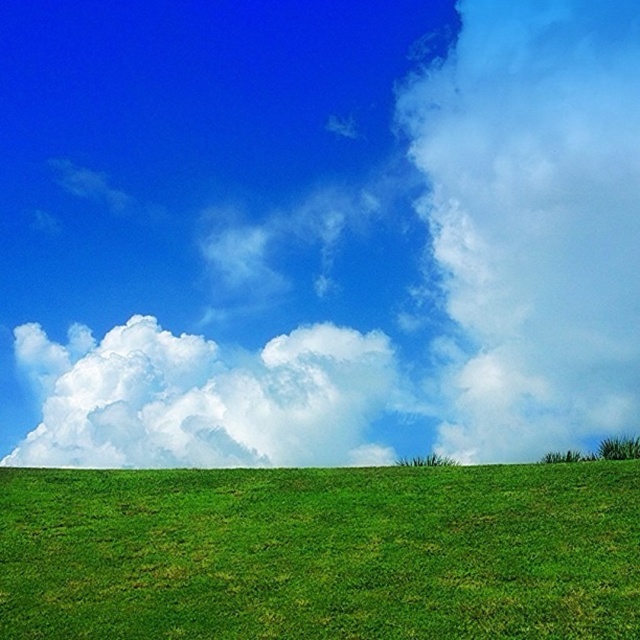
Does green grass at lower center have a lesser height compared to white fluffy cloud at center?

No.

Who is higher up, green grass at lower center or white fluffy cloud at center?

green grass at lower center

The image size is (640, 640). Describe the element at coordinates (316, 230) in the screenshot. I see `green grass at lower center` at that location.

In order to click on green grass at lower center in this screenshot , I will do `click(316, 230)`.

Is green grassy hill at lower center to the right of white fluffy cloud at center from the viewer's perspective?

Indeed, green grassy hill at lower center is positioned on the right side of white fluffy cloud at center.

Is green grassy hill at lower center thinner than white fluffy cloud at center?

No.

Between point (36, 566) and point (298, 369), which one is positioned behind?

Point (298, 369)

This screenshot has width=640, height=640. I want to click on green grassy hill at lower center, so click(321, 554).

Is point (220, 92) positioned in front of point (195, 481)?

No, it is behind (195, 481).

Which is below, green grass at lower center or green grassy hill at lower center?

Positioned lower is green grassy hill at lower center.

Where is `green grass at lower center`? The height and width of the screenshot is (640, 640). green grass at lower center is located at coordinates (316, 230).